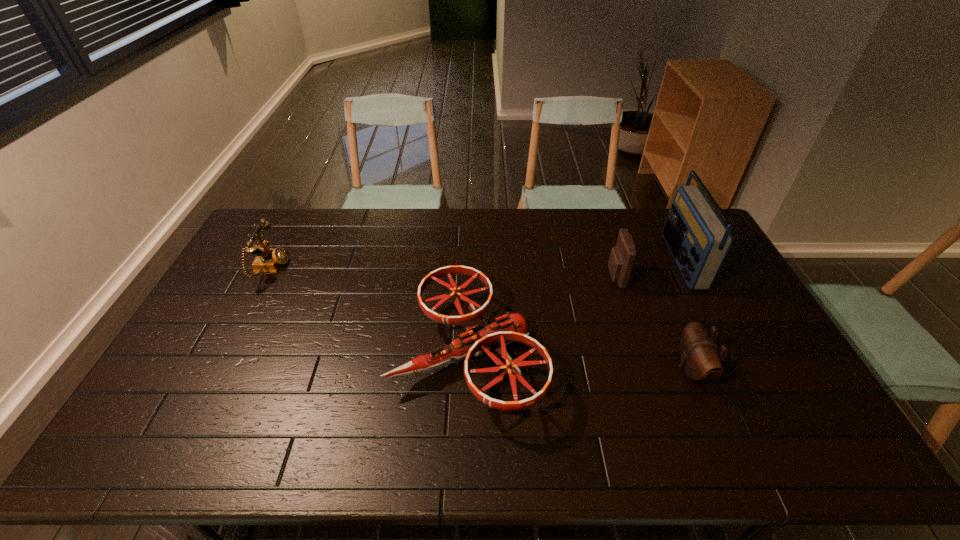
Identify the location of object that is at the near edge. This screenshot has width=960, height=540. (480, 336).

Identify the location of object that is at the left edge. (268, 260).

Where is `object located at the right edge`? The height and width of the screenshot is (540, 960). object located at the right edge is located at coordinates (699, 241).

Where is `object at the far right corner`? object at the far right corner is located at coordinates (699, 241).

Find the location of a particular element. The width and height of the screenshot is (960, 540). vacant space at the far edge is located at coordinates (516, 235).

You are a GUI agent. You are given a task and a screenshot of the screen. Output one action in this format:
    pyautogui.click(x=<x>, y=<y>)
    Task: Click on the vacant area at the near edge
    Image resolution: width=960 pixels, height=540 pixels.
    Given the screenshot: What is the action you would take?
    pyautogui.click(x=703, y=442)

Locate an element on the screen. The width and height of the screenshot is (960, 540). vacant space at the left edge of the desktop is located at coordinates (189, 427).

The image size is (960, 540). I want to click on free space at the right edge, so click(749, 334).

Where is `empty space between the telephone and the tallest object`? The height and width of the screenshot is (540, 960). empty space between the telephone and the tallest object is located at coordinates (476, 265).

I want to click on free space that is in between the nearer pouch and the tallest object, so click(x=686, y=315).